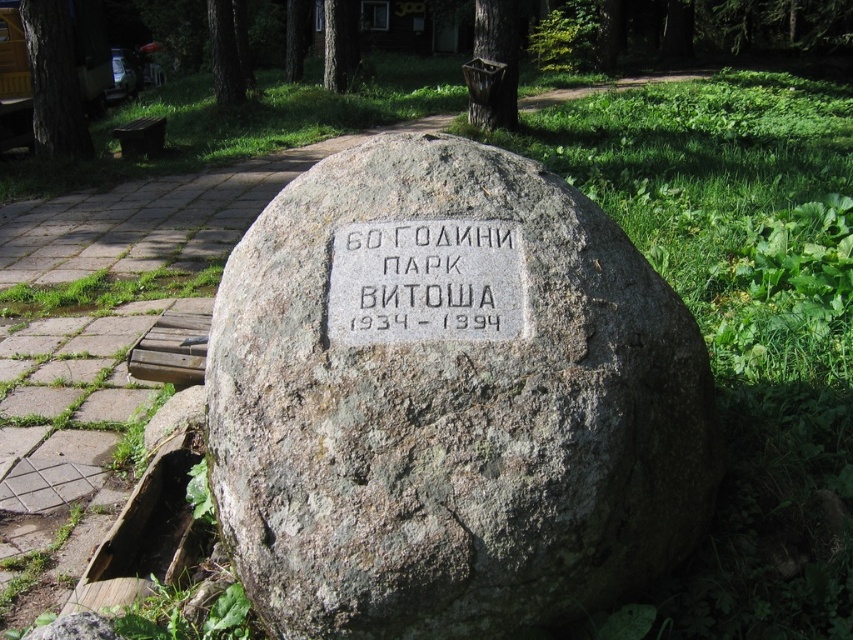
Question: Does brown rough tree trunk at upper left have a greater width compared to green textured tree at upper center?

Choices:
 (A) no
 (B) yes

Answer: (B)

Question: Among these objects, which one is nearest to the camera?

Choices:
 (A) green leafy tree at upper center
 (B) smooth brown wooden basket at upper center

Answer: (B)

Question: Is brown rough tree trunk at upper left thinner than green textured tree at upper center?

Choices:
 (A) yes
 (B) no

Answer: (B)

Question: Which object is the closest to the gray stone plaque at center?

Choices:
 (A) green leafy tree at upper center
 (B) smooth brown wooden basket at upper center
 (C) green bark tree at upper center
 (D) gray stone boulder at center

Answer: (D)

Question: Among these objects, which one is nearest to the camera?

Choices:
 (A) green textured tree at upper center
 (B) gray stone plaque at center
 (C) green bark tree at upper center
 (D) gray stone boulder at center

Answer: (D)

Question: Does gray stone boulder at center have a larger size compared to green leafy tree at upper center?

Choices:
 (A) no
 (B) yes

Answer: (B)